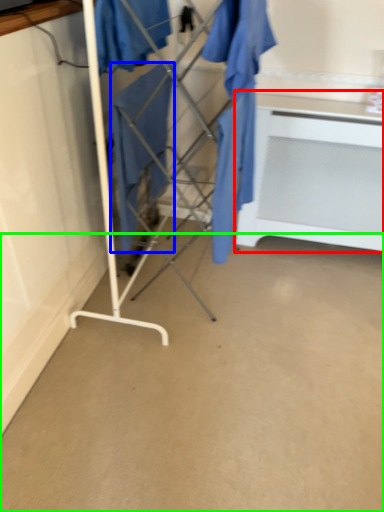
Question: Estimate the real-world distances between objects in this image. Which object is farther from table (highlighted by a red box), clothing (highlighted by a blue box) or concrete (highlighted by a green box)?

Choices:
 (A) clothing
 (B) concrete

Answer: (B)